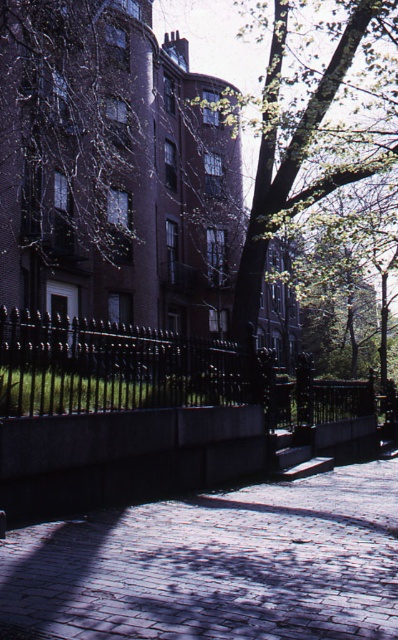
You are a tourist standing on the cobblestone pavement at center and looking up. Is the green leafy tree at upper center directly above you or to one side?

The cobblestone pavement at center is below the green leafy tree at upper center, so the tree is directly above you.

You are a tourist standing on the cobblestone pavement at center and want to take a photo of the green leafy tree at upper center. To frame the tree properly, you need to know its position relative to the pavement. Can you tell me which side of the tree the pavement is on?

The cobblestone pavement at center is positioned on the left side of the green leafy tree at upper center, so the pavement is to the left of the tree.

You are standing at the entrance of the cobblestone street and want to walk towards the black wrought iron fence. Which direction should you move relative to the cobblestone pavement at center?

The cobblestone pavement at center is located at point (216, 564), so you should move towards the direction of the cobblestone pavement at center to reach the black wrought iron fence.